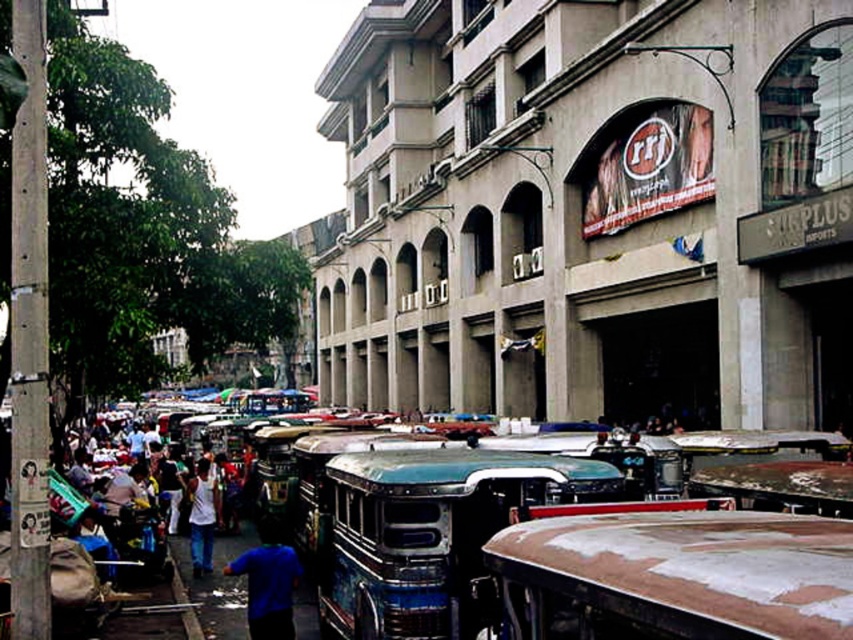
Question: Is rusty metal bus at center further to camera compared to blue matte shirt at lower center?

Choices:
 (A) no
 (B) yes

Answer: (A)

Question: Is rusty metal bus at center positioned at the back of white matte shirt at center?

Choices:
 (A) yes
 (B) no

Answer: (B)

Question: Does rusty metal bus at center have a smaller size compared to blue matte shirt at lower center?

Choices:
 (A) no
 (B) yes

Answer: (B)

Question: Based on their relative distances, which object is nearer to the blue matte shirt at lower center?

Choices:
 (A) white matte shirt at center
 (B) rusty metal bus at center

Answer: (B)

Question: Based on their relative distances, which object is farther from the rusty metal bus at center?

Choices:
 (A) blue matte shirt at lower center
 (B) white matte shirt at center

Answer: (B)

Question: Which of the following is the farthest from the observer?

Choices:
 (A) (252, 614)
 (B) (196, 548)

Answer: (B)